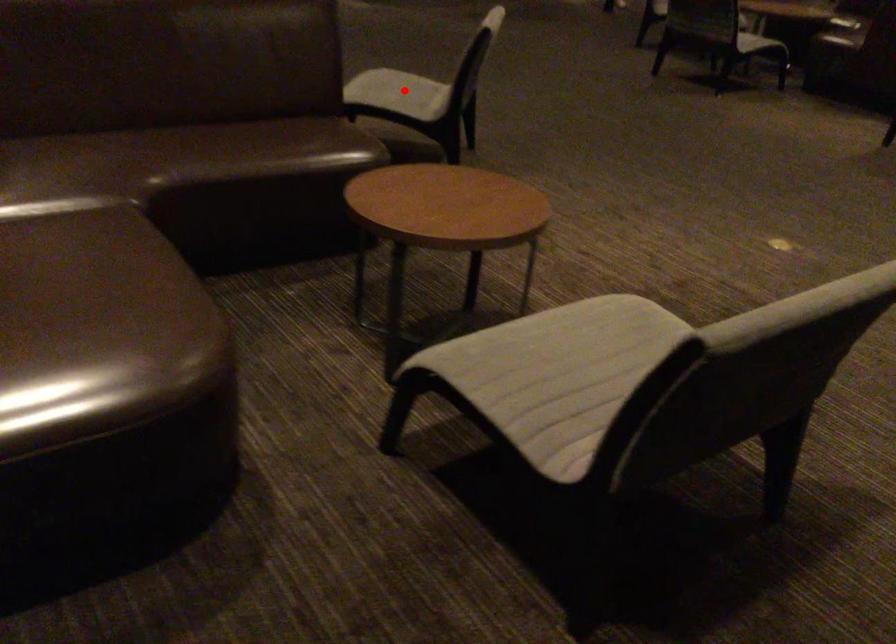
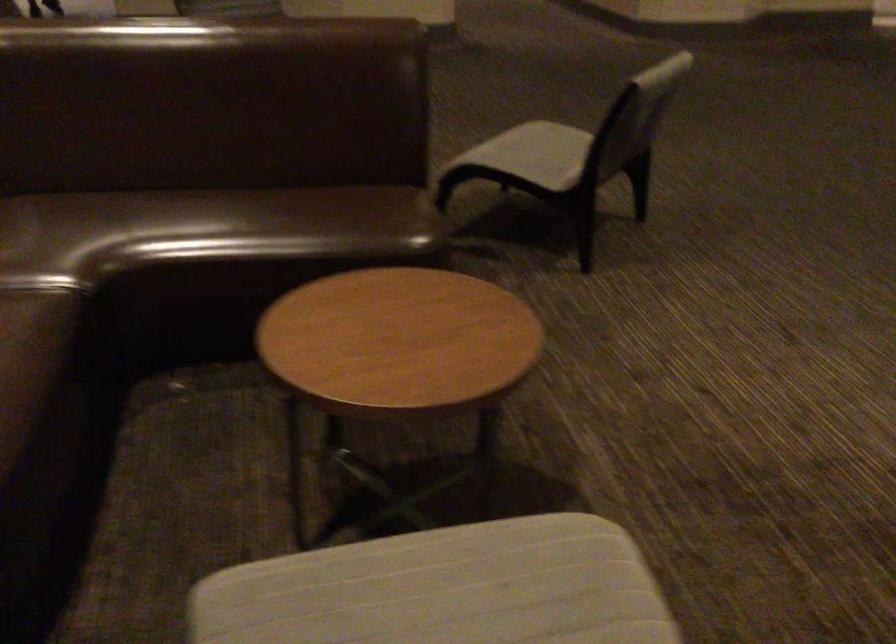
The point at the highlighted location is marked in the first image. Where is the corresponding point in the second image?

(533, 154)